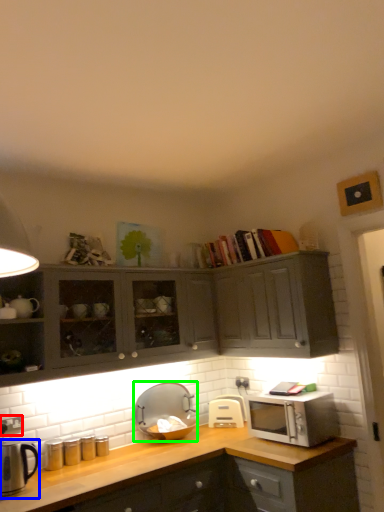
Question: Based on their relative distances, which object is nearer to electric outlet (highlighted by a red box)? Choose from appliance (highlighted by a blue box) and appliance (highlighted by a green box).

Choices:
 (A) appliance
 (B) appliance

Answer: (A)